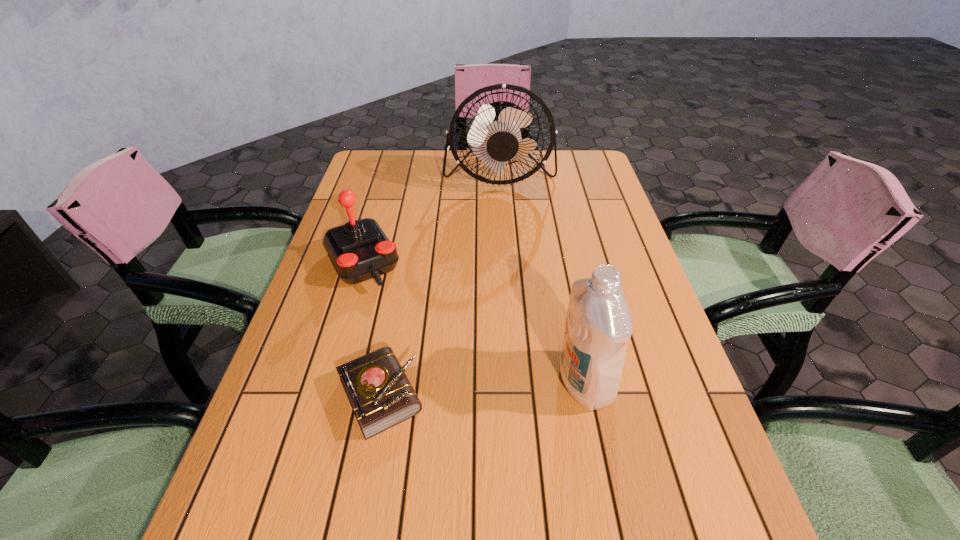
This screenshot has width=960, height=540. Find the location of `object that is the second closest to the shortest object`. object that is the second closest to the shortest object is located at coordinates (598, 327).

The image size is (960, 540). Identify the location of vacant space that satisfies the following two spatial constraints: 1. in front of the detergent, directing airflow; 2. on the right side of the farthest object. (513, 382).

Locate an element on the screen. The width and height of the screenshot is (960, 540). free location that satisfies the following two spatial constraints: 1. in front of the fan, directing airflow; 2. on the right side of the detergent is located at coordinates (513, 382).

I want to click on vacant area in the image that satisfies the following two spatial constraints: 1. in front of the fan, directing airflow; 2. on the right side of the detergent, so click(513, 382).